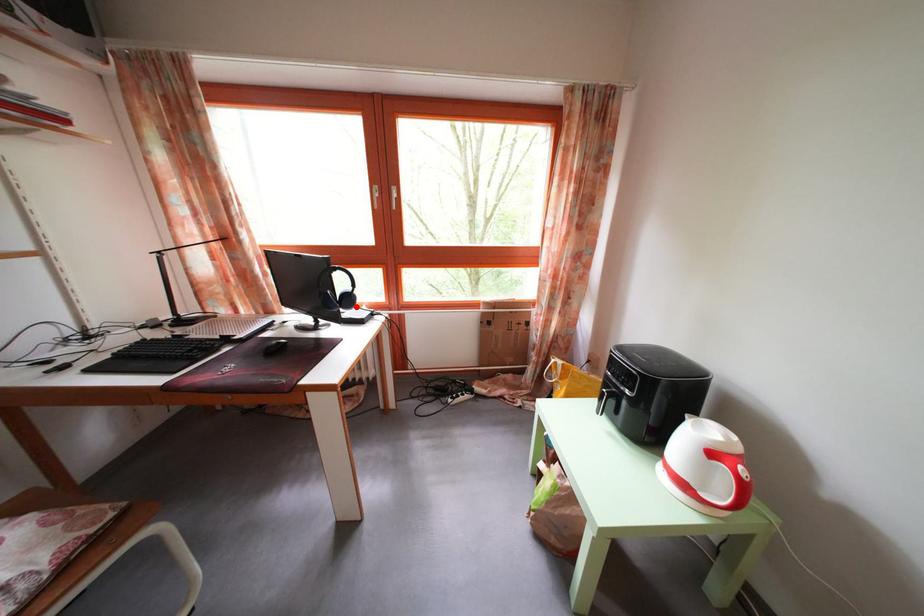
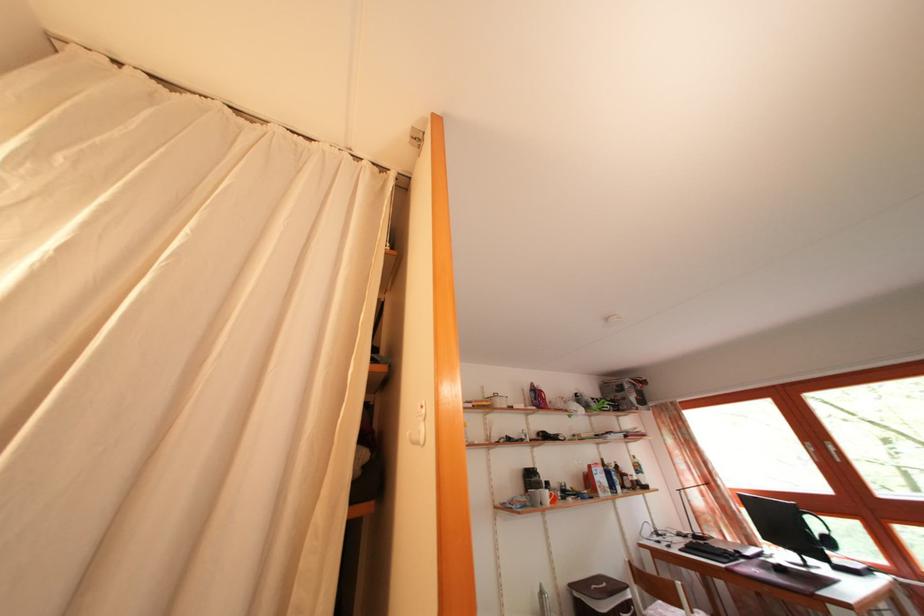
Question: A red point is marked in image1. In image2, is the corresponding 3D point closer to the camera or farther? Reply with the corresponding letter.

Choices:
 (A) The corresponding 3D point is closer.
 (B) The corresponding 3D point is farther.

Answer: (A)